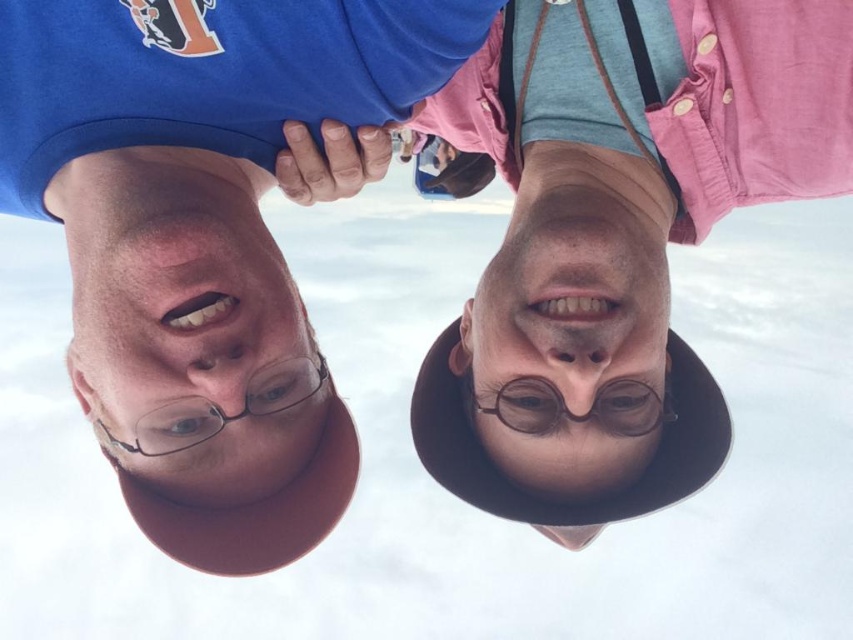
Question: Which object is farther from the camera taking this photo?

Choices:
 (A) matte skin face at center
 (B) matte black glasses at center
 (C) pink fabric at upper right
 (D) matte brown face at center

Answer: (B)

Question: Estimate the real-world distances between objects in this image. Which object is farther from the matte brown face at center?

Choices:
 (A) matte black glasses at center
 (B) matte skin face at center
 (C) pink fabric at upper right

Answer: (B)

Question: From the image, what is the correct spatial relationship of matte brown face at center in relation to matte black glasses at center?

Choices:
 (A) below
 (B) above

Answer: (B)

Question: Does matte brown face at center have a smaller size compared to matte black glasses at center?

Choices:
 (A) no
 (B) yes

Answer: (A)

Question: Can you confirm if matte skin face at center is positioned below matte brown face at center?

Choices:
 (A) yes
 (B) no

Answer: (B)

Question: Which point is closer to the camera?

Choices:
 (A) (641, 417)
 (B) (433, 99)

Answer: (A)